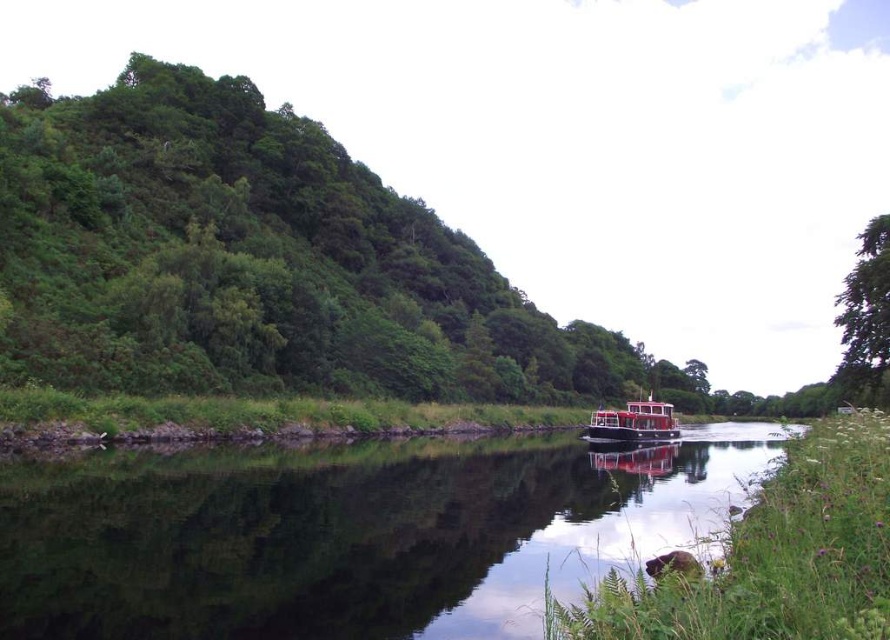
Measure the distance between green leafy hillside at left and camera.

green leafy hillside at left is 122.58 feet away from camera.

Between point (664, 364) and point (620, 426), which one is positioned behind?

The point (664, 364) is behind.

Between point (249, 234) and point (640, 426), which one is positioned in front?

Point (640, 426) is more forward.

Where is `green leafy hillside at left`? The image size is (890, 640). green leafy hillside at left is located at coordinates point(261,260).

Who is lower down, green leafy tree at upper right or red matte boat at center?

Positioned lower is red matte boat at center.

Is point (864, 369) closer to viewer compared to point (670, 426)?

Yes, point (864, 369) is closer to viewer.

At what (x,y) coordinates should I click in order to perform the action: click on green leafy tree at upper right. Please return your answer as a coordinate pair (x, y). The height and width of the screenshot is (640, 890). Looking at the image, I should click on (864, 320).

Is clear glass water at center further to the viewer compared to red matte boat at center?

No.

Is point (79, 588) positioned after point (601, 426)?

No, it is in front of (601, 426).

Image resolution: width=890 pixels, height=640 pixels. What do you see at coordinates (350, 534) in the screenshot?
I see `clear glass water at center` at bounding box center [350, 534].

I want to click on clear glass water at center, so click(x=350, y=534).